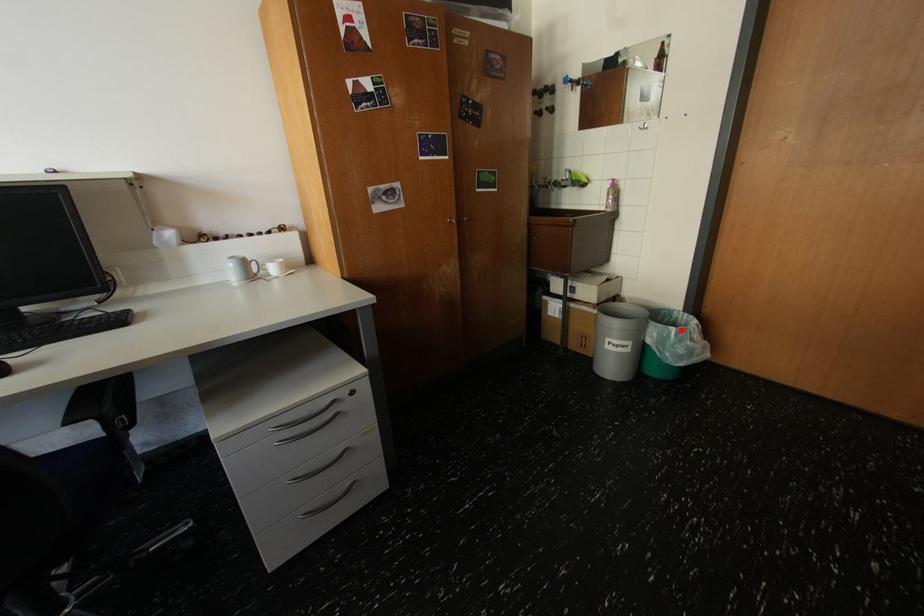
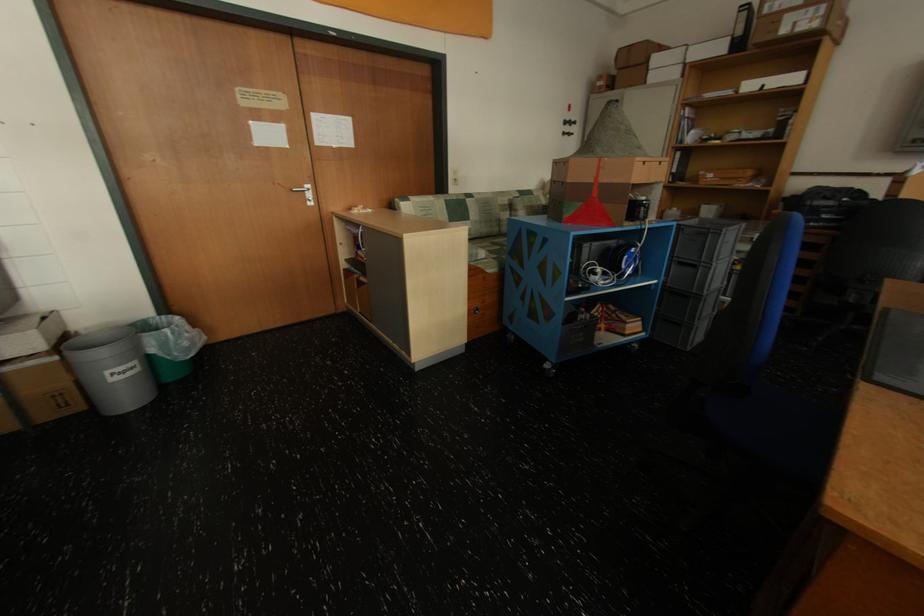
Question: I am providing you with two images of the same scene from different viewpoints. Given a red point in image1, look at the same physical point in image2. Is it:

Choices:
 (A) Closer to the viewpoint
 (B) Farther from the viewpoint

Answer: (A)